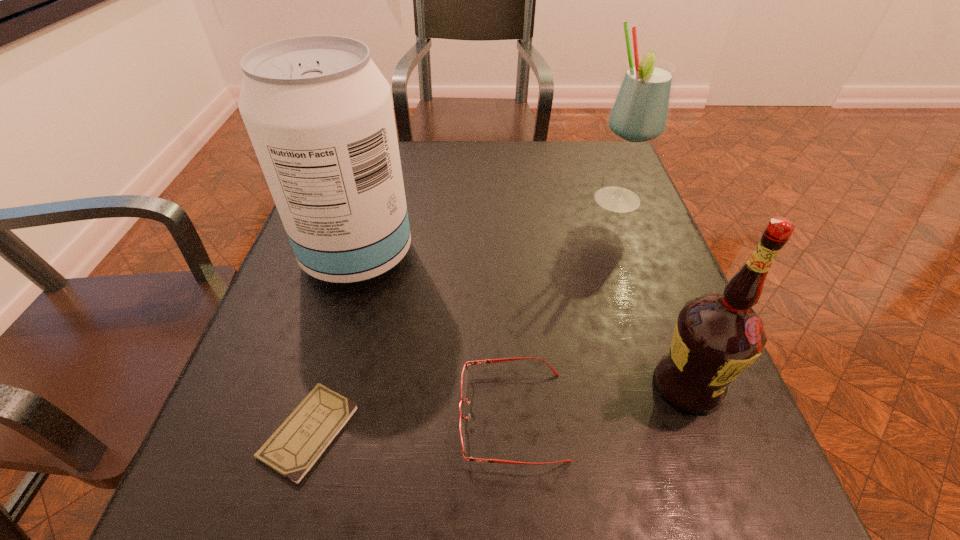
Locate an element on the screen. The height and width of the screenshot is (540, 960). the second nearest alcohol is located at coordinates (319, 113).

The image size is (960, 540). What are the coordinates of `the second farthest object` in the screenshot? It's located at point(319,113).

Find the location of a particular element. the farthest object is located at coordinates (640, 111).

The height and width of the screenshot is (540, 960). What are the coordinates of `the third shortest object` in the screenshot? It's located at (717, 336).

Locate an element on the screen. Image resolution: width=960 pixels, height=540 pixels. the nearest alcohol is located at coordinates click(717, 336).

At what (x,y) coordinates should I click in order to perform the action: click on spectacles. Please return your answer as a coordinate pair (x, y). This screenshot has width=960, height=540. Looking at the image, I should click on (464, 376).

This screenshot has height=540, width=960. Identify the location of the fourth tallest object. (464, 376).

You are a GUI agent. You are given a task and a screenshot of the screen. Output one action in this format:
    pyautogui.click(x=<x>, y=<y>)
    Task: Click on the checkbook
    
    Given the screenshot: What is the action you would take?
    pyautogui.click(x=292, y=450)

The width and height of the screenshot is (960, 540). What are the coordinates of `free location located on the back of the leftmost alcohol` in the screenshot? It's located at (372, 206).

Identify the location of blank space located on the back of the farthest object. coord(600,157).